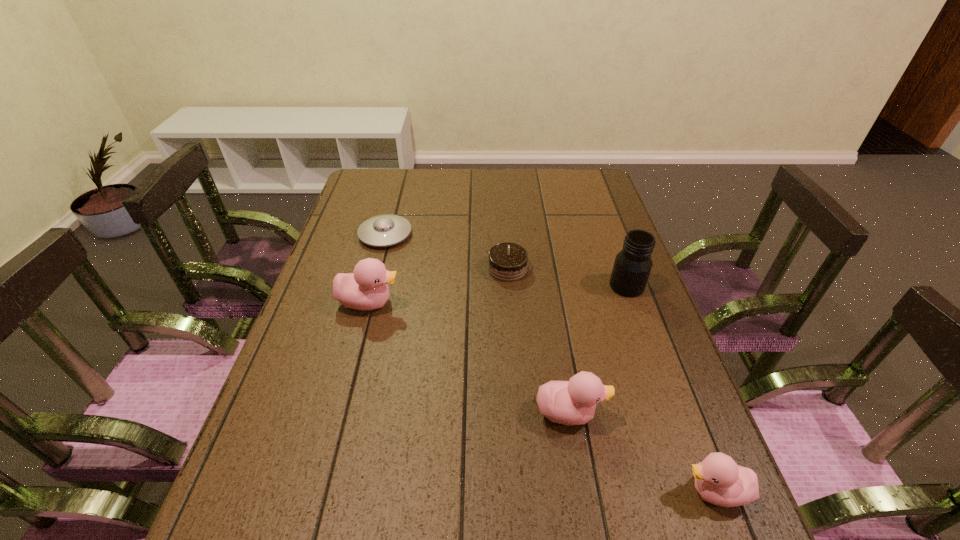
Locate an element on the screen. The height and width of the screenshot is (540, 960). vacant position for inserting another duckling evenly is located at coordinates (458, 351).